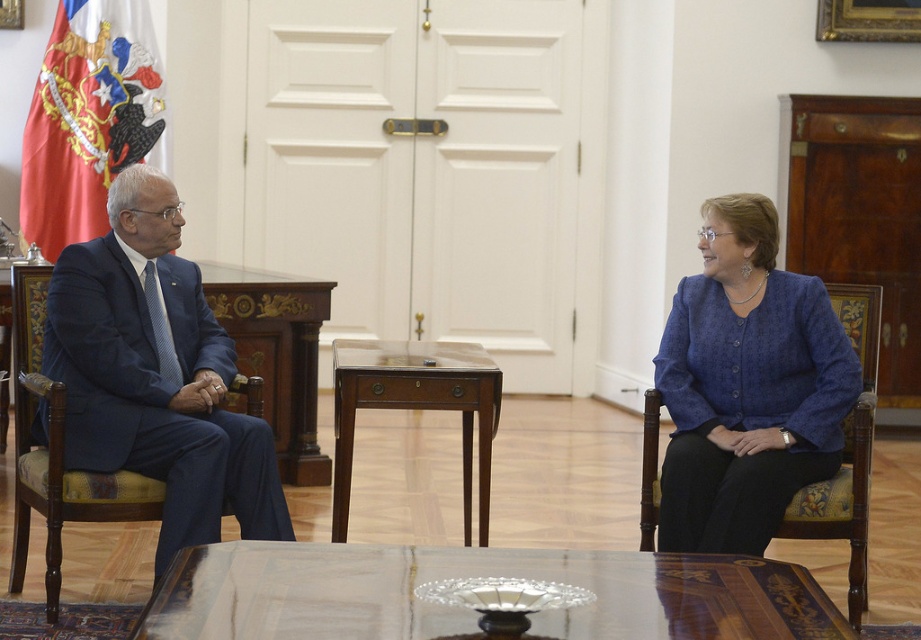
You are an interior designer observing the formal meeting scene. You need to place a decorative vase on the mahogany wood side table at center. To ensure it doesn not obstruct the view of the blue textured blazer at right, should the vase be placed on the side table? Explain your reasoning.

The blue textured blazer at right is closer to the viewer than the mahogany wood side table at center. Placing the vase on the side table would actually be farther away from the blazer, so it won not obstruct the view of the blazer.

You are an interior designer planning to place a new 1.2 meter wide sofa in this meeting room. The sofa must be placed between the wooden polished table at center and the mahogany wood side table at center. Will the sofa fit in the space between them?

The wooden polished table at center is wider than the mahogany wood side table at center. Since the sofa is 1.2 meters wide, we need to know the exact width difference between the two tables to determine if the space between them can accommodate the sofa. However, the provided information only states that the wooden polished table is wider, not the specific measurement. Therefore, it is uncertain if the sofa will fit without additional details.

You are an interior designer planning to place a new lamp in this office. The lamp requires a space of 0.5 meters in width. Can the point marked by coordinates point (747, 387) accommodate the lamp?

The point marked by coordinates point (747, 387) corresponds to the blue textured blazer at right, which is an object occupying space. Therefore, placing the lamp there would not be possible as it is already occupied by the blazer.